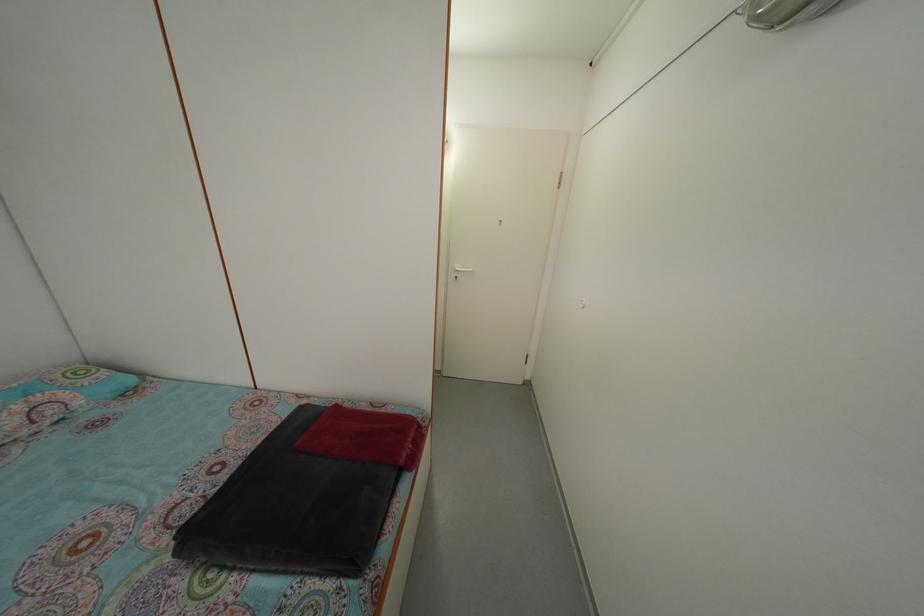
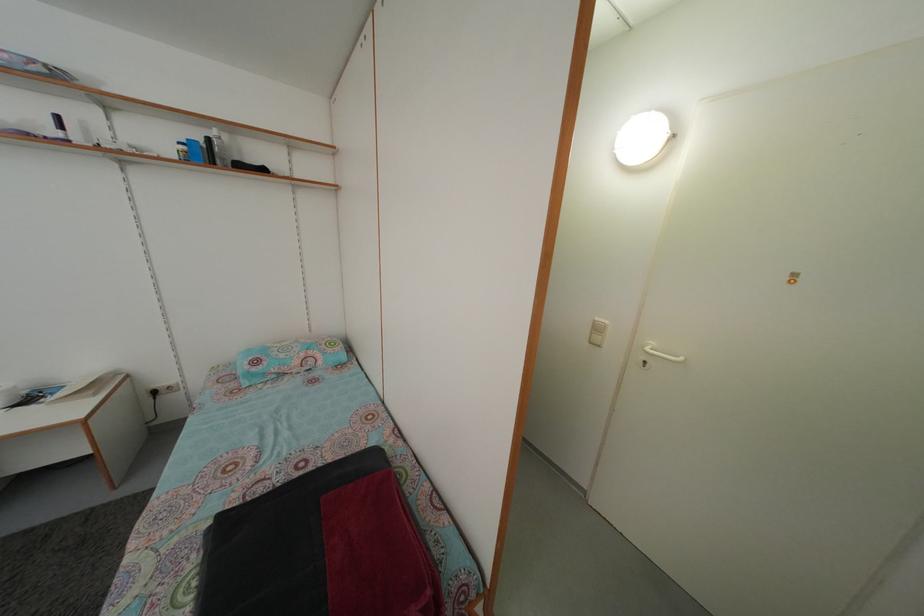
Where in the second image is the point corresponding to point (463, 276) from the first image?

(652, 355)